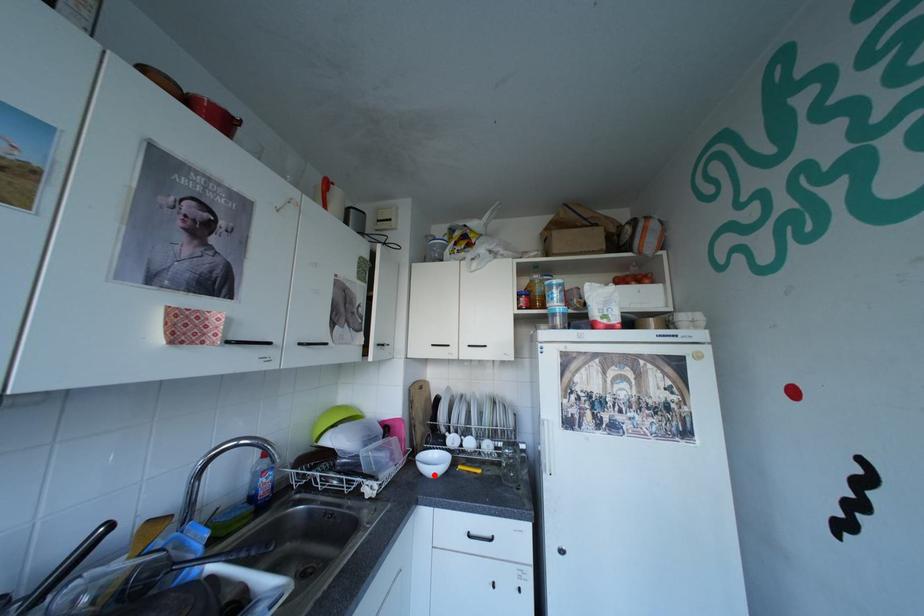
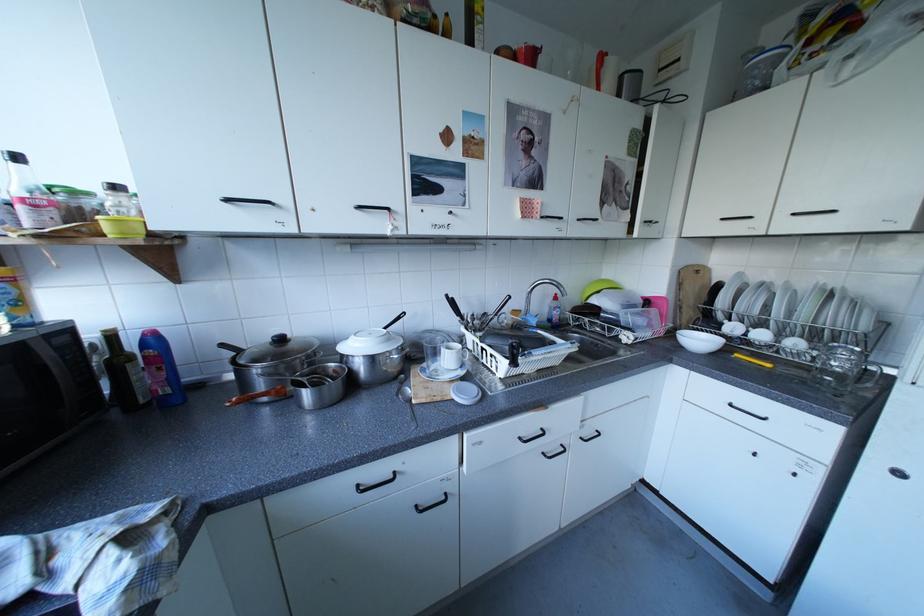
Question: I am providing you with two images of the same scene from different viewpoints. In image1, a red point is highlighted. Considering the same 3D point in image2, which of the following is correct?

Choices:
 (A) It is closer
 (B) It is farther

Answer: (A)